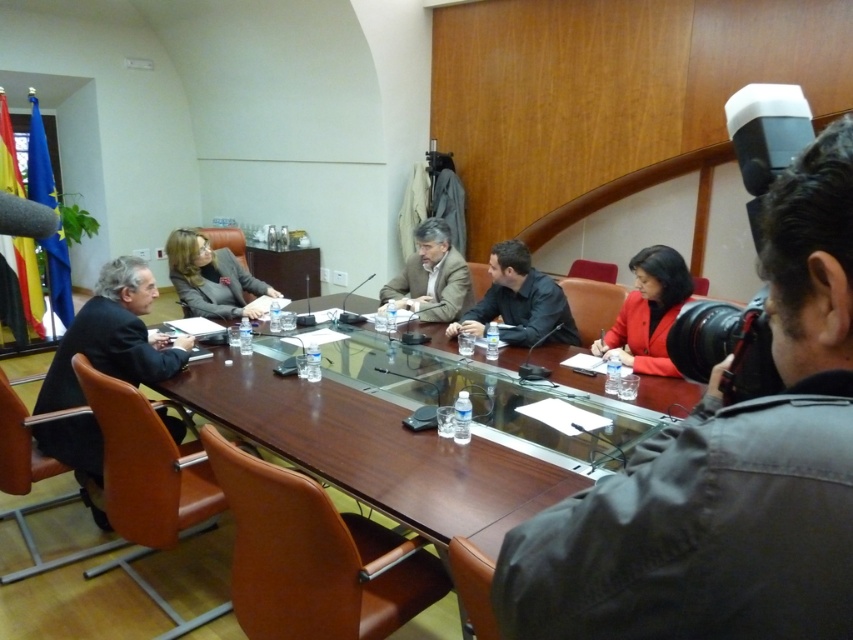
You are an event planner arranging seating for a photo op. You need to place two items on a shelf so that the shorter one is on the left. Given the matte black jacket at lower right and the matte red blazer at center, which one should you place on the left?

The matte black jacket at lower right is not as tall as the matte red blazer at center, so you should place the matte black jacket at lower right on the left side of the shelf since it is shorter.

In the scene shown: You are organizing a meeting and need to place a new decorative item on the table. Considering the existing items on the brown wooden table at center, where would the matte black jacket at lower right currently be placed?

The matte black jacket at lower right is placed at the lower right area of the brown wooden table at center, and it has a smaller size compared to the table itself, so there is enough space for the new decorative item.

In the scene shown: You are a photographer setting up for a group photo of the meeting participants. You need to ensure that all clothing items mentioned are visible in the frame. Given the spatial relationship between the black fabric suit at left and the matte red blazer at center, which clothing item should be positioned closer to the camera to ensure both are fully visible?

The black fabric suit at left is taller than the matte red blazer at center, so positioning the black fabric suit at left closer to the camera will help ensure both are fully visible without one blocking the other.